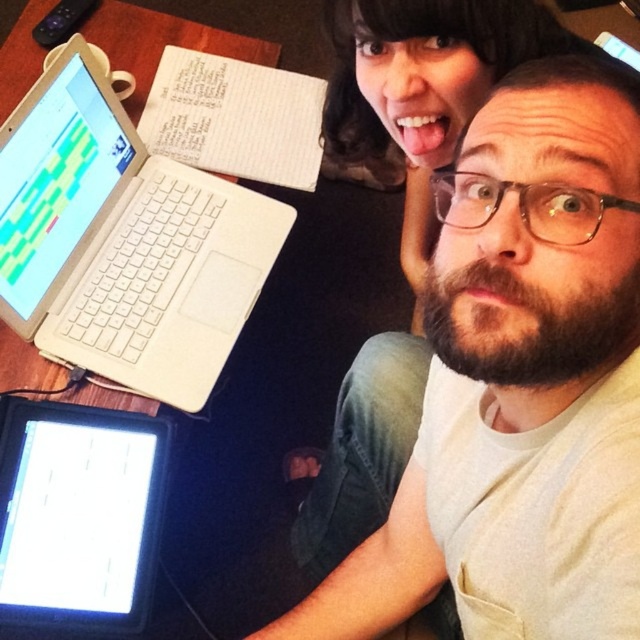
Question: Which of the following is the farthest from the observer?

Choices:
 (A) white plastic laptop at upper left
 (B) black glossy tablet at lower left
 (C) white matte laptop at upper left

Answer: (A)

Question: Among these objects, which one is nearest to the camera?

Choices:
 (A) white plastic laptop at upper left
 (B) black glossy tablet at lower left

Answer: (B)

Question: Is white matte laptop at upper left below wooden table at upper left?

Choices:
 (A) no
 (B) yes

Answer: (B)

Question: Does white matte laptop at upper left have a larger size compared to white plastic laptop at upper left?

Choices:
 (A) no
 (B) yes

Answer: (B)

Question: Among these points, which one is nearest to the camera?

Choices:
 (A) (435, 323)
 (B) (13, 508)
 (C) (204, 548)

Answer: (A)

Question: Is wooden table at upper left further to camera compared to white plastic laptop at upper left?

Choices:
 (A) no
 (B) yes

Answer: (B)